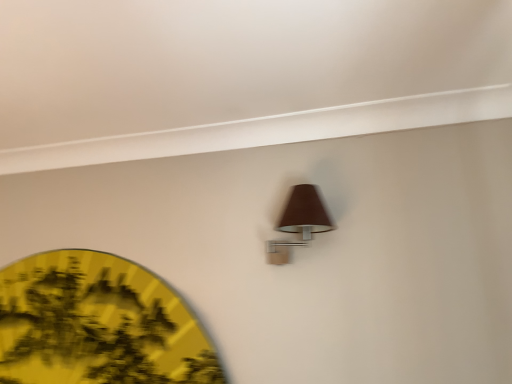
The height and width of the screenshot is (384, 512). In order to click on brown fabric lamp at upper center in this screenshot , I will do `click(298, 222)`.

Measure the distance between brown fabric lamp at upper center and camera.

A distance of 4.43 feet exists between brown fabric lamp at upper center and camera.

What do you see at coordinates (298, 222) in the screenshot? This screenshot has width=512, height=384. I see `brown fabric lamp at upper center` at bounding box center [298, 222].

What is the approximate height of yellow paper fan at lower left?

yellow paper fan at lower left is 22.02 inches in height.

Where is `yellow paper fan at lower left`? This screenshot has height=384, width=512. yellow paper fan at lower left is located at coordinates (97, 324).

What do you see at coordinates (97, 324) in the screenshot?
I see `yellow paper fan at lower left` at bounding box center [97, 324].

Where is `brown fabric lamp at upper center`? brown fabric lamp at upper center is located at coordinates (298, 222).

Which object is positioned more to the left, yellow paper fan at lower left or brown fabric lamp at upper center?

Positioned to the left is yellow paper fan at lower left.

Considering the relative positions of yellow paper fan at lower left and brown fabric lamp at upper center in the image provided, is yellow paper fan at lower left in front of brown fabric lamp at upper center?

No.

Does point (15, 381) come behind point (325, 224)?

Yes.

From the image's perspective, between yellow paper fan at lower left and brown fabric lamp at upper center, which one is located above?

brown fabric lamp at upper center appears higher in the image.

From a real-world perspective, is yellow paper fan at lower left under brown fabric lamp at upper center?

Indeed, from a real-world perspective, yellow paper fan at lower left is positioned beneath brown fabric lamp at upper center.

Is yellow paper fan at lower left wider than brown fabric lamp at upper center?

No, yellow paper fan at lower left is not wider than brown fabric lamp at upper center.

Looking at this image, considering the sizes of objects yellow paper fan at lower left and brown fabric lamp at upper center in the image provided, who is taller, yellow paper fan at lower left or brown fabric lamp at upper center?

Standing taller between the two is yellow paper fan at lower left.

Who is bigger, yellow paper fan at lower left or brown fabric lamp at upper center?

Bigger between the two is yellow paper fan at lower left.

Would you say yellow paper fan at lower left is outside brown fabric lamp at upper center?

Yes, yellow paper fan at lower left is located beyond the bounds of brown fabric lamp at upper center.

Looking at this image, is yellow paper fan at lower left touching brown fabric lamp at upper center?

yellow paper fan at lower left and brown fabric lamp at upper center are not in contact.

Could you tell me if yellow paper fan at lower left is facing brown fabric lamp at upper center?

No, yellow paper fan at lower left is not turned towards brown fabric lamp at upper center.

Can you tell me how much yellow paper fan at lower left and brown fabric lamp at upper center differ in facing direction?

0.184 degrees separate the facing orientations of yellow paper fan at lower left and brown fabric lamp at upper center.

How much distance is there between yellow paper fan at lower left and brown fabric lamp at upper center?

A distance of 27.00 inches exists between yellow paper fan at lower left and brown fabric lamp at upper center.

You are a GUI agent. You are given a task and a screenshot of the screen. Output one action in this format:
    pyautogui.click(x=<x>, y=<y>)
    Task: Click on the lamp that is in front of the yellow paper fan at lower left
    
    Given the screenshot: What is the action you would take?
    pyautogui.click(x=298, y=222)

Is brown fabric lamp at upper center to the left or to the right of yellow paper fan at lower left in the image?

Based on their positions, brown fabric lamp at upper center is located to the right of yellow paper fan at lower left.

Is the position of brown fabric lamp at upper center less distant than that of yellow paper fan at lower left?

Yes, the depth of brown fabric lamp at upper center is less than that of yellow paper fan at lower left.

Which is in front, point (327, 225) or point (64, 343)?

The point (327, 225) is closer.

From the image's perspective, is brown fabric lamp at upper center located above or below yellow paper fan at lower left?

Clearly, from the image's perspective, brown fabric lamp at upper center is above yellow paper fan at lower left.

From a real-world perspective, is brown fabric lamp at upper center below yellow paper fan at lower left?

No.

Which object is wider, brown fabric lamp at upper center or yellow paper fan at lower left?

brown fabric lamp at upper center is wider.

Looking at this image, in terms of height, does brown fabric lamp at upper center look taller or shorter compared to yellow paper fan at lower left?

brown fabric lamp at upper center is shorter than yellow paper fan at lower left.

Is brown fabric lamp at upper center bigger than yellow paper fan at lower left?

No.

Choose the correct answer: Is brown fabric lamp at upper center inside yellow paper fan at lower left or outside it?

brown fabric lamp at upper center is not inside yellow paper fan at lower left, it's outside.

Is brown fabric lamp at upper center not close to yellow paper fan at lower left?

They are positioned close to each other.

Is brown fabric lamp at upper center oriented towards yellow paper fan at lower left?

No, brown fabric lamp at upper center is not facing towards yellow paper fan at lower left.

What's the angular difference between brown fabric lamp at upper center and yellow paper fan at lower left's facing directions?

They differ by 0.184 degrees in their facing directions.

How distant is brown fabric lamp at upper center from yellow paper fan at lower left?

They are 27.00 inches apart.

Locate an element on the screen. This screenshot has width=512, height=384. lamp above the yellow paper fan at lower left (from a real-world perspective) is located at coordinates (298, 222).

You are a GUI agent. You are given a task and a screenshot of the screen. Output one action in this format:
    pyautogui.click(x=<x>, y=<y>)
    Task: Click on the circle below the brown fabric lamp at upper center (from the image's perspective)
    
    Given the screenshot: What is the action you would take?
    pyautogui.click(x=97, y=324)

Identify the location of lamp above the yellow paper fan at lower left (from the image's perspective). This screenshot has height=384, width=512. (298, 222).